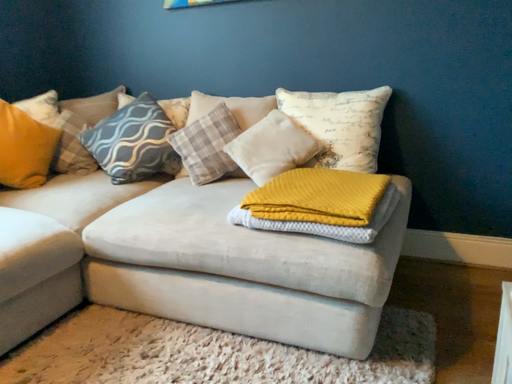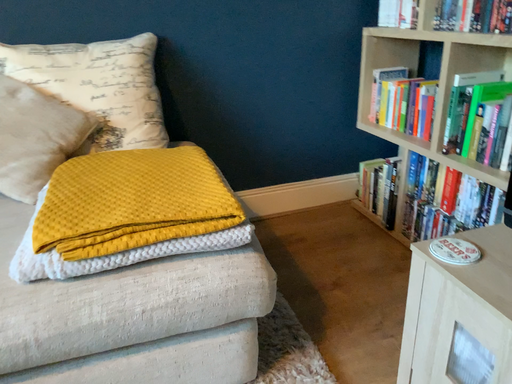
Question: How did the camera likely rotate when shooting the video?

Choices:
 (A) rotated left
 (B) rotated right

Answer: (B)